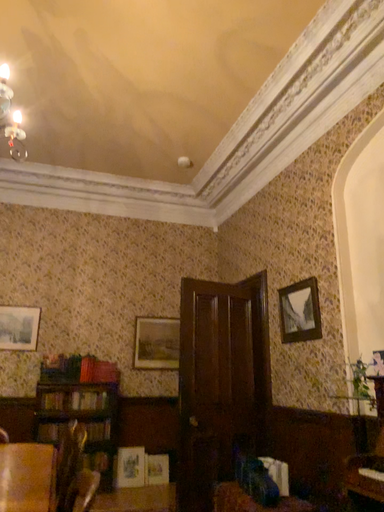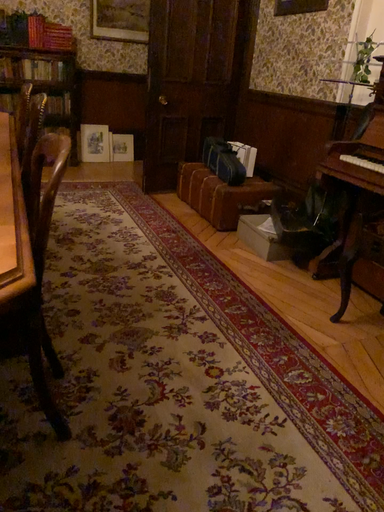
Question: How did the camera likely rotate when shooting the video?

Choices:
 (A) rotated upward
 (B) rotated downward

Answer: (B)